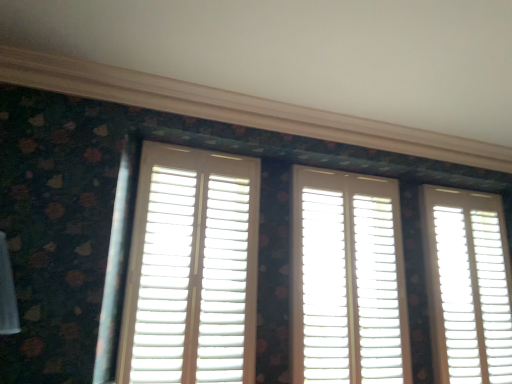
Question: Is white wood shutters at center, the 2th window in the left-to-right sequence, positioned with its back to white matte shutter at right, acting as the 3th window starting from the left?

Choices:
 (A) yes
 (B) no

Answer: (B)

Question: Considering the relative sizes of white wood shutters at center, the 2th window in the left-to-right sequence, and white matte shutter at right, acting as the 3th window starting from the left, in the image provided, is white wood shutters at center, the 2th window in the left-to-right sequence, wider than white matte shutter at right, acting as the 3th window starting from the left,?

Choices:
 (A) no
 (B) yes

Answer: (B)

Question: Could you tell me if white wood shutters at center, marked as the 2th window in a right-to-left arrangement, is facing white matte shutter at right, the first window positioned from the right?

Choices:
 (A) yes
 (B) no

Answer: (B)

Question: Is white wood shutters at center, the 2th window in the left-to-right sequence, thinner than white matte shutter at right, acting as the 3th window starting from the left?

Choices:
 (A) yes
 (B) no

Answer: (B)

Question: From a real-world perspective, is white wood shutters at center, the 2th window in the left-to-right sequence, beneath white matte shutter at right, the first window positioned from the right?

Choices:
 (A) yes
 (B) no

Answer: (B)

Question: From the image's perspective, is white wood shutters at center, marked as the 2th window in a right-to-left arrangement, located beneath white matte shutter at right, the first window positioned from the right?

Choices:
 (A) yes
 (B) no

Answer: (B)

Question: Can you confirm if white matte shutter at right, acting as the 3th window starting from the left, is shorter than white wood shutters at center, the 2th window in the left-to-right sequence?

Choices:
 (A) no
 (B) yes

Answer: (A)

Question: Does white matte shutter at right, acting as the 3th window starting from the left, have a smaller size compared to white wood shutters at center, the 2th window in the left-to-right sequence?

Choices:
 (A) yes
 (B) no

Answer: (A)

Question: Is white matte shutter at right, the first window positioned from the right, behind white wood shutters at center, marked as the 2th window in a right-to-left arrangement?

Choices:
 (A) yes
 (B) no

Answer: (A)

Question: From the image's perspective, does white matte shutter at right, acting as the 3th window starting from the left, appear lower than white wood shutters at center, the 2th window in the left-to-right sequence?

Choices:
 (A) no
 (B) yes

Answer: (B)

Question: Can you confirm if white matte shutter at right, the first window positioned from the right, is bigger than white wood shutters at center, marked as the 2th window in a right-to-left arrangement?

Choices:
 (A) yes
 (B) no

Answer: (B)

Question: Is white matte shutter at right, acting as the 3th window starting from the left, directly adjacent to white matte shutters at center, which is the third window in right-to-left order?

Choices:
 (A) yes
 (B) no

Answer: (B)